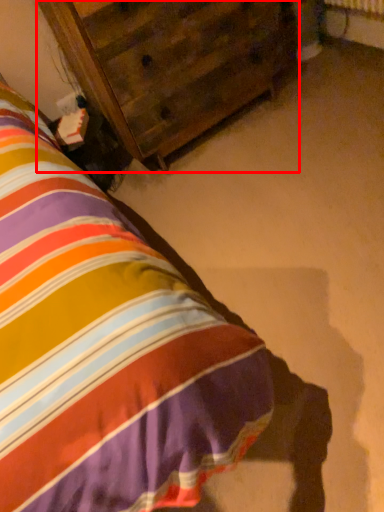
Question: Observing the image, what is the correct spatial positioning of furniture (annotated by the red box) in reference to nightstand?

Choices:
 (A) right
 (B) left

Answer: (B)